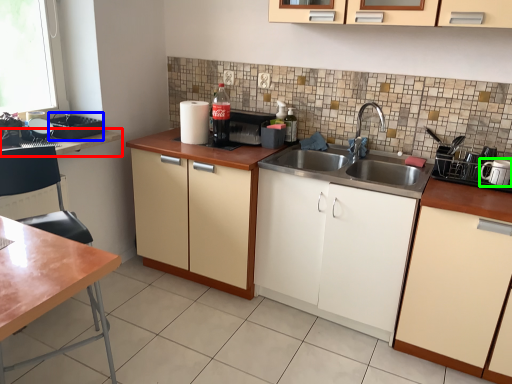
Question: Which is nearer to the countertop (highlighted by a red box)? appliance (highlighted by a blue box) or appliance (highlighted by a green box).

Choices:
 (A) appliance
 (B) appliance

Answer: (A)